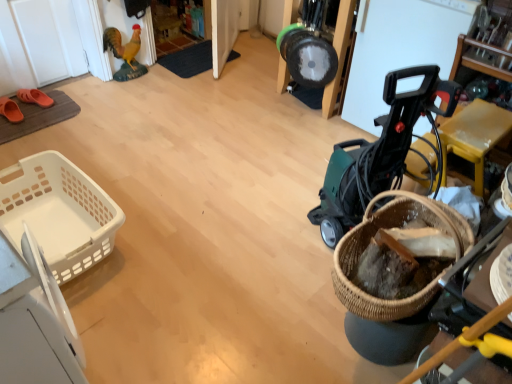
The image size is (512, 384). In order to click on vacant area that is in front of orange rubber clog at left, which ranks as the 1th footwear in back-to-front order in this screenshot , I will do `click(30, 120)`.